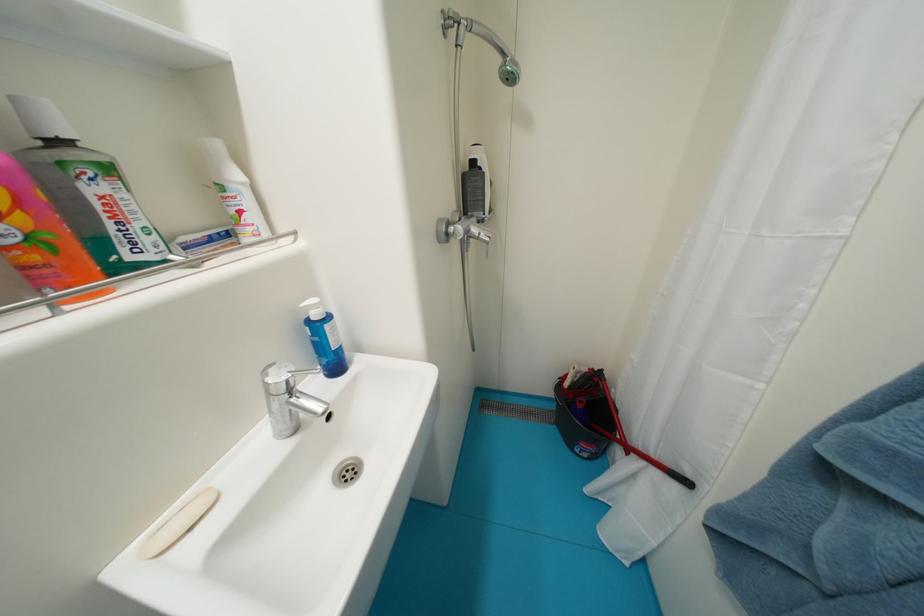
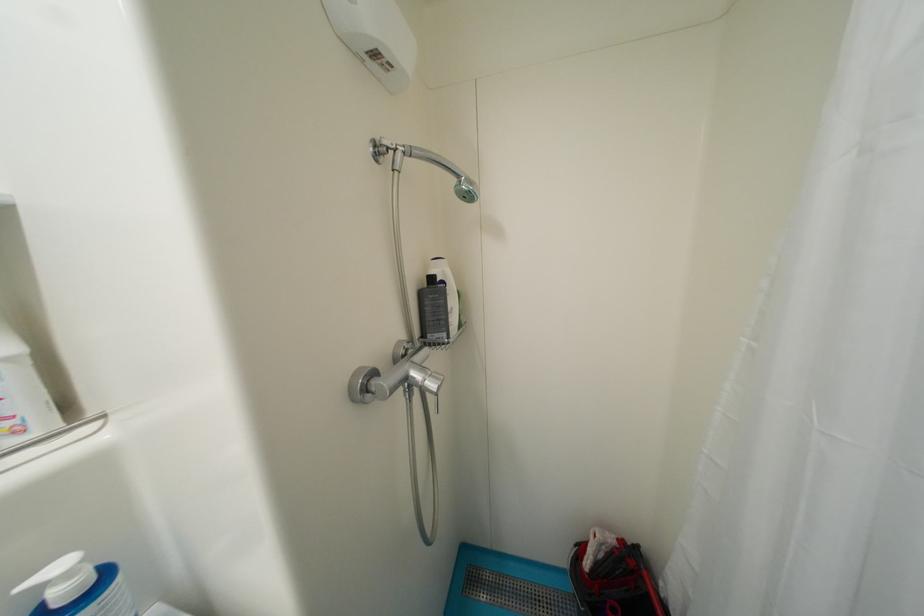
The point at [454,229] is marked in the first image. Where is the corresponding point in the second image?

(374, 383)